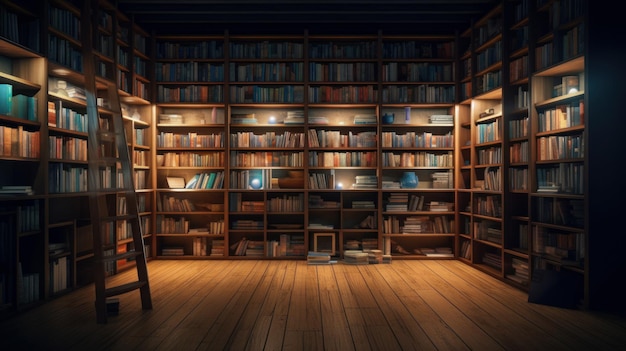
You are a GUI agent. You are given a task and a screenshot of the screen. Output one action in this format:
    pyautogui.click(x=<x>, y=<y>)
    Task: Click on the steps on the ladder
    The image size is (626, 351).
    Given the screenshot: What is the action you would take?
    pyautogui.click(x=111, y=291), pyautogui.click(x=118, y=256), pyautogui.click(x=116, y=216), pyautogui.click(x=114, y=189), pyautogui.click(x=105, y=159), pyautogui.click(x=104, y=136), pyautogui.click(x=108, y=112), pyautogui.click(x=98, y=77)